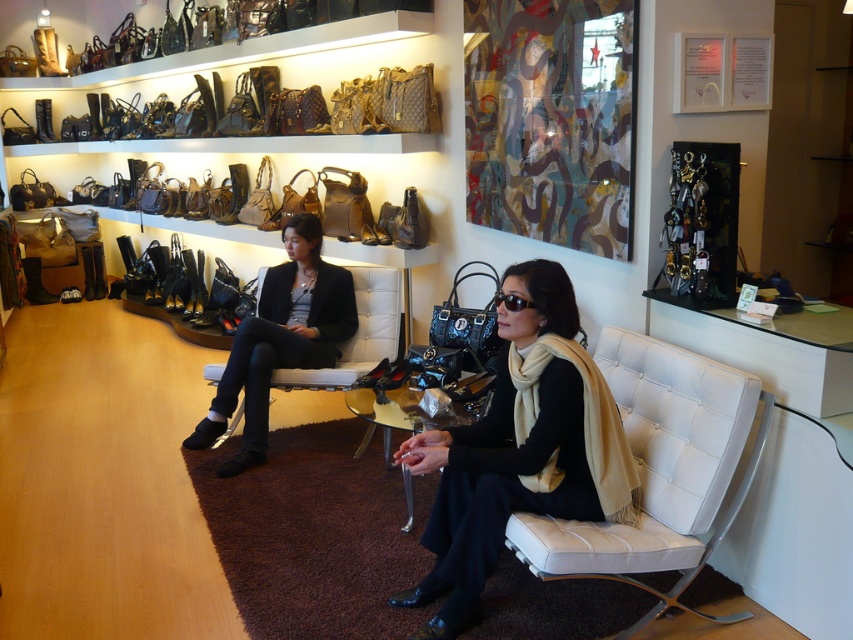
Question: Among these objects, which one is nearest to the camera?

Choices:
 (A) black leather shoes at center
 (B) white leather chair at center
 (C) black leather scarf at center

Answer: (B)

Question: Is white leather chair at center closer to camera compared to black leather shoes at center?

Choices:
 (A) no
 (B) yes

Answer: (B)

Question: Does white leather chair at center have a lesser width compared to black leather shoes at center?

Choices:
 (A) yes
 (B) no

Answer: (B)

Question: Which object appears closest to the camera in this image?

Choices:
 (A) black leather shoes at center
 (B) black leather scarf at center

Answer: (B)

Question: Which point is farther to the camera?

Choices:
 (A) (715, 435)
 (B) (506, 364)
 (C) (279, 316)

Answer: (C)

Question: Can you confirm if black leather scarf at center is positioned above black leather shoes at center?

Choices:
 (A) no
 (B) yes

Answer: (A)